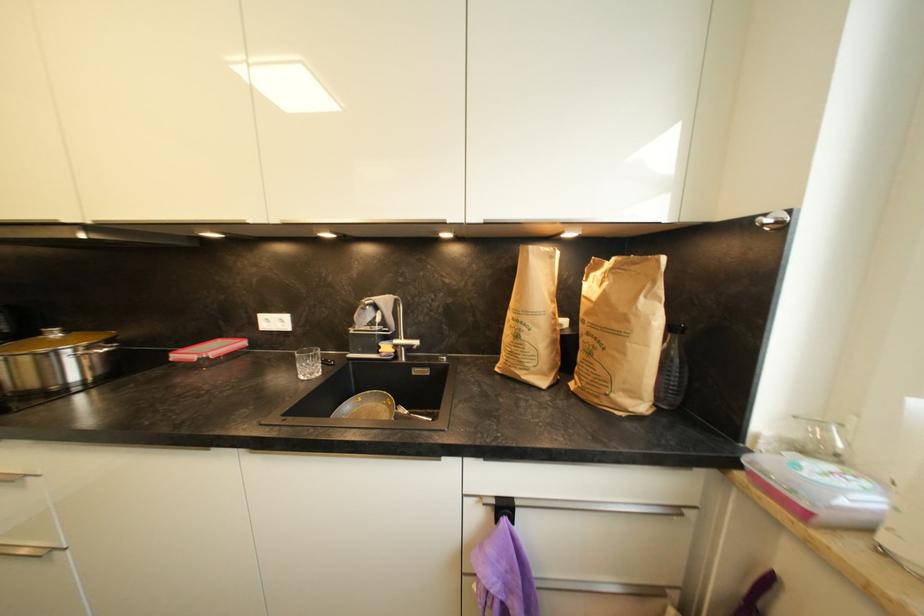
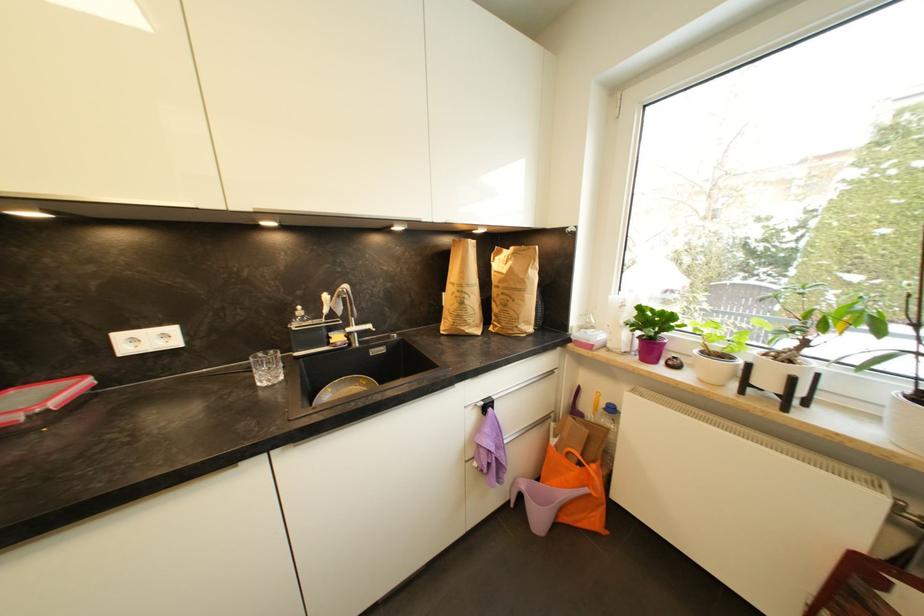
Question: How did the camera likely rotate?

Choices:
 (A) Left
 (B) Right
 (C) Up
 (D) Down

Answer: (B)